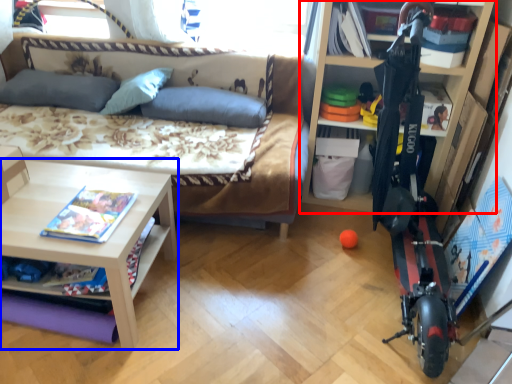
Question: Which object is closer to the camera taking this photo, shelf (highlighted by a red box) or table (highlighted by a blue box)?

Choices:
 (A) shelf
 (B) table

Answer: (B)